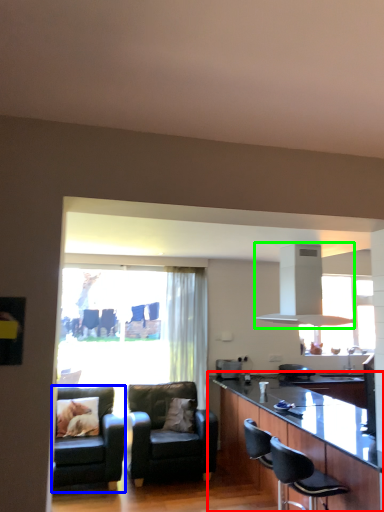
Question: Considering the real-world distances, which object is closest to cabinetry (highlighted by a red box)? chair (highlighted by a blue box) or exhaust hood (highlighted by a green box).

Choices:
 (A) chair
 (B) exhaust hood

Answer: (B)